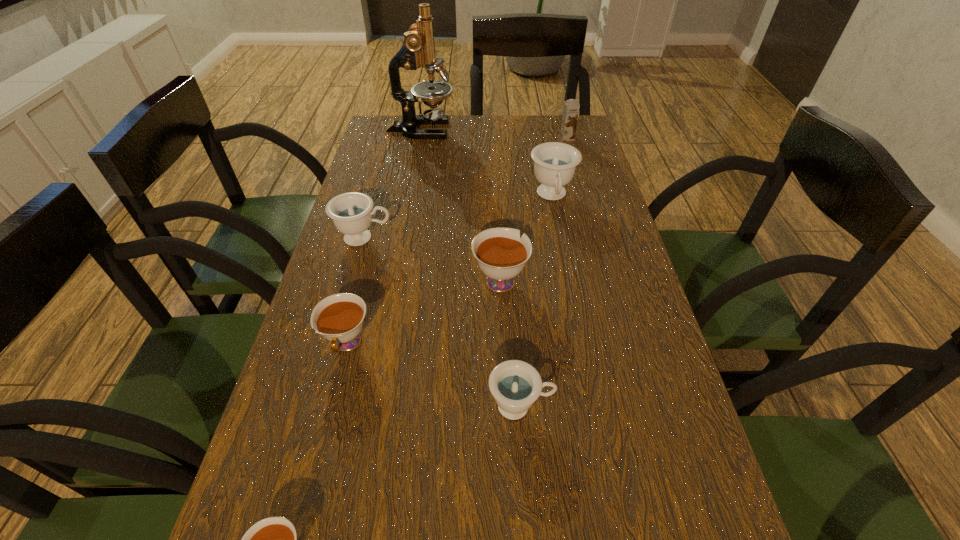
Locate an element on the screen. the second smallest white teacup is located at coordinates (339, 318).

I want to click on the seventh farthest object, so click(x=516, y=385).

This screenshot has height=540, width=960. I want to click on the second nearest teacup, so click(x=516, y=385).

Where is `vacant space situated at the eyepiece of the gray microscope`? vacant space situated at the eyepiece of the gray microscope is located at coordinates (488, 130).

Find the location of a particular element. This screenshot has width=960, height=540. vacant space located on the front of the chocolate milk is located at coordinates (584, 200).

Locate an element on the screen. The image size is (960, 540). vacant space located on the side of the rightmost teacup with the handle is located at coordinates (562, 246).

Find the location of a particular element. The width and height of the screenshot is (960, 540). vacant space located on the side of the farthest white teacup with the handle is located at coordinates (498, 239).

Where is `free space located on the side of the farthest white teacup with the handle`? Image resolution: width=960 pixels, height=540 pixels. free space located on the side of the farthest white teacup with the handle is located at coordinates [x=496, y=179].

Find the location of a particular element. The height and width of the screenshot is (540, 960). vacant point located 0.260m on the side of the farthest white teacup with the handle is located at coordinates click(x=496, y=195).

Locate an element on the screen. This screenshot has height=540, width=960. vacant space located 0.150m on the side of the second farthest blue teacup with the handle is located at coordinates (451, 238).